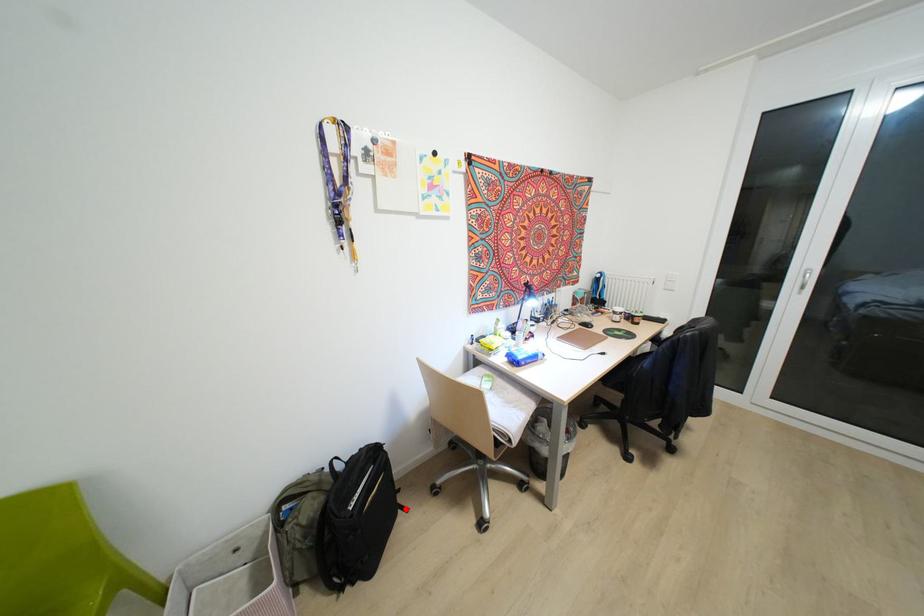
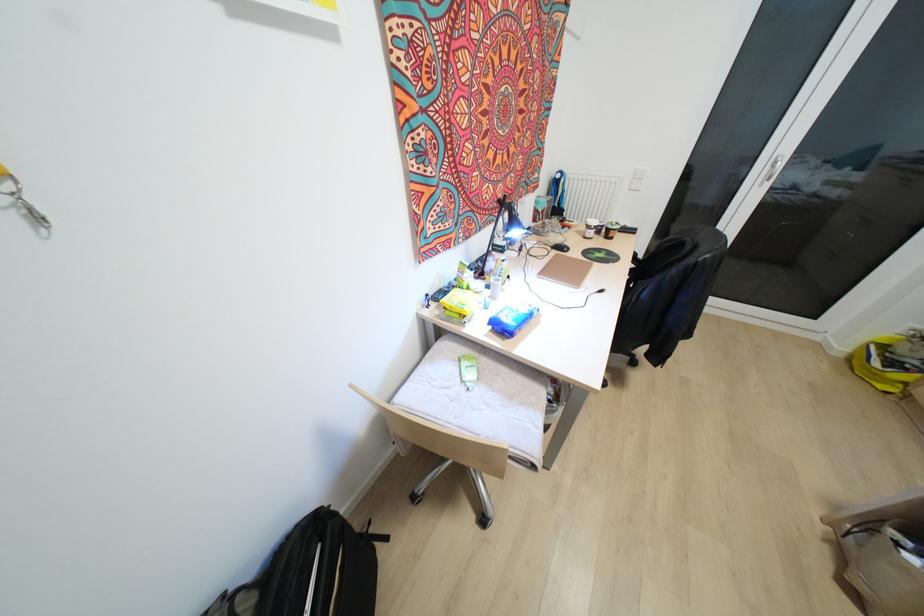
Question: I am providing you with two images of the same scene from different viewpoints. Given a red point in image1, look at the same physical point in image2. Is it:

Choices:
 (A) Closer to the viewpoint
 (B) Farther from the viewpoint

Answer: (A)